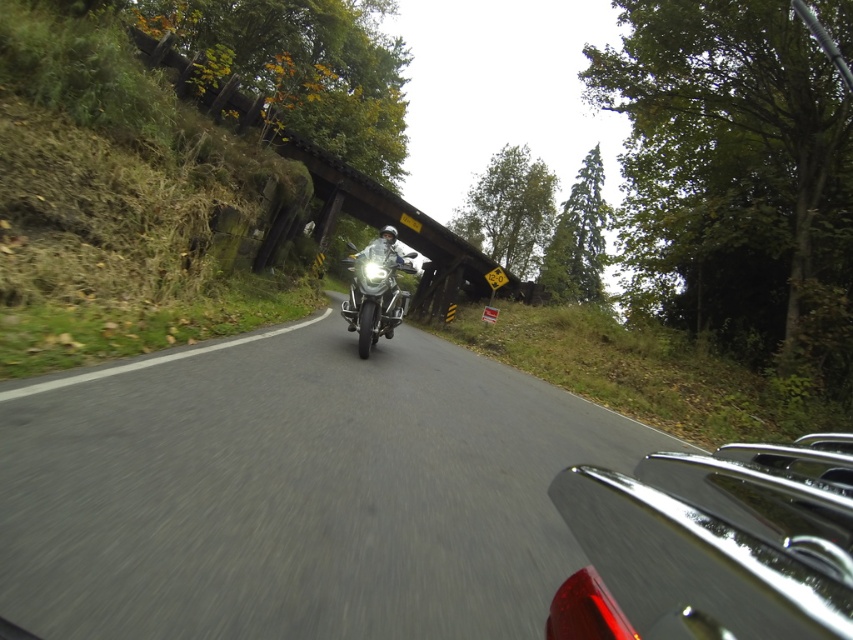
You are a drone operator planning to fly a drone over the black asphalt road at center and the wooden bridge at center. Based on their heights, which one do you think the drone will need to ascend to reach first?

The black asphalt road at center is not as tall as the wooden bridge at center, so the drone will need to ascend to reach the wooden bridge at center first.

You are a delivery driver who needs to cross the wooden bridge at center while staying on the black asphalt road at center. Is the road positioned in a way that allows you to stay on the road while crossing the bridge?

The black asphalt road at center is positioned on the right side of wooden bridge at center, so yes, the road is on the bridge and you can stay on the road while crossing the wooden bridge at center.